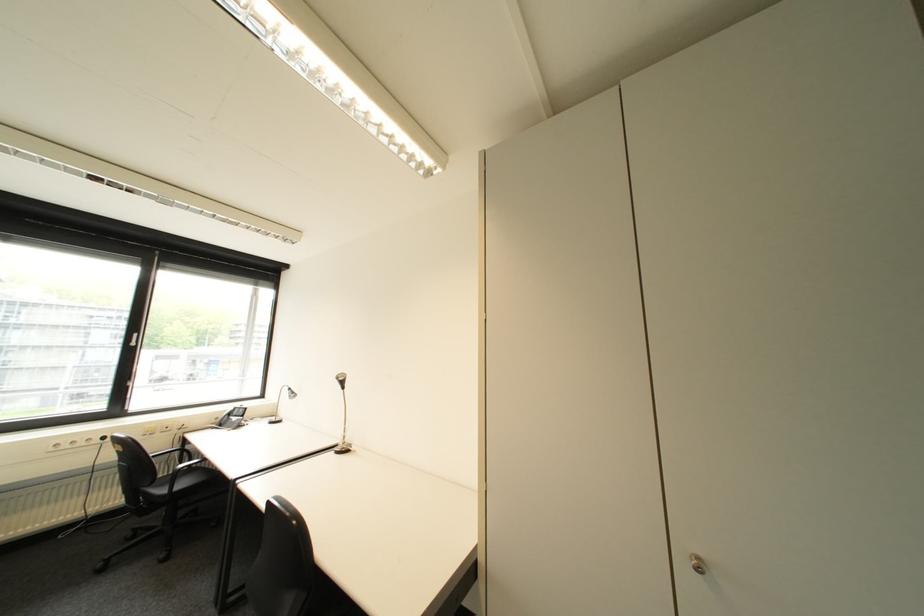
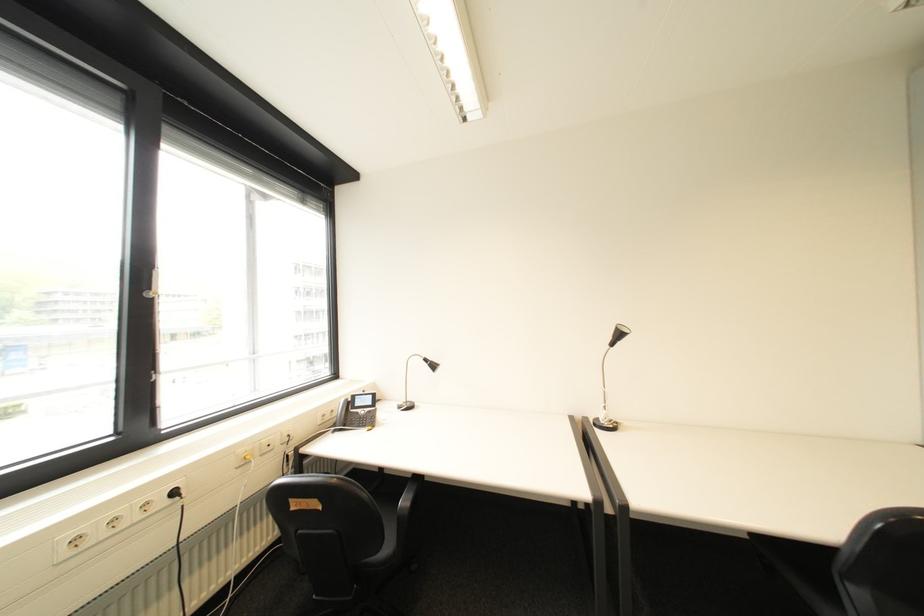
In a continuous first-person perspective shot, in which direction is the camera moving?

The cameraman moved toward left, forward.